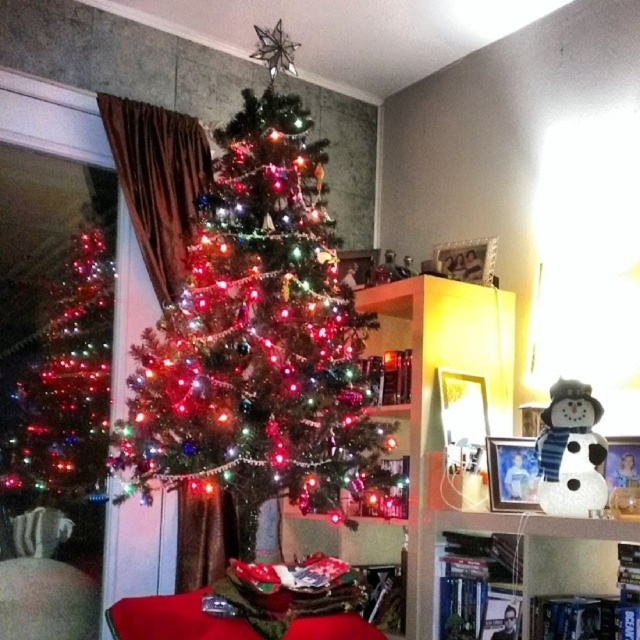
Question: Which is farther from the white matte snowman at upper right?

Choices:
 (A) shiny metallic christmas tree at left
 (B) wooden bookshelf at center
 (C) white glittery snowman at lower right
 (D) iridescent shiny christmas tree at center

Answer: (A)

Question: Considering the real-world distances, which object is closest to the wooden bookshelf at center?

Choices:
 (A) white matte snowman at upper right
 (B) iridescent shiny christmas tree at center
 (C) white glittery snowman at lower right

Answer: (A)

Question: Is shiny metallic christmas tree at left thinner than white glittery snowman at lower right?

Choices:
 (A) no
 (B) yes

Answer: (A)

Question: Which point is closer to the camera?

Choices:
 (A) (570, 460)
 (B) (435, 508)
 (C) (476, 307)
 (D) (148, 461)

Answer: (D)

Question: Can you confirm if shiny metallic christmas tree at left is wider than white glittery snowman at lower right?

Choices:
 (A) yes
 (B) no

Answer: (A)

Question: Observing the image, what is the correct spatial positioning of wooden bookshelf at center in reference to shiny metallic christmas tree at left?

Choices:
 (A) left
 (B) right

Answer: (B)